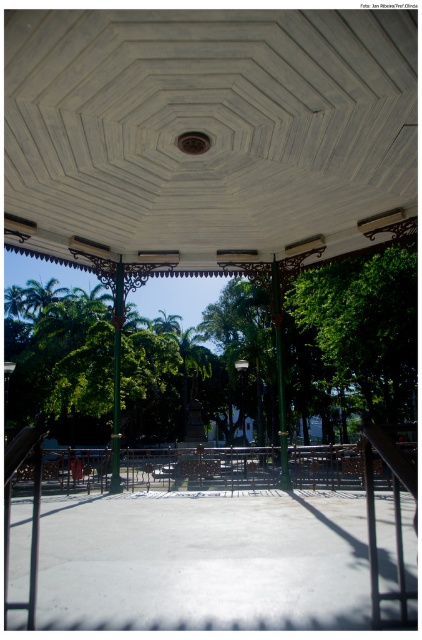
You are standing inside the gazebo and want to place a large bench between the green leafy tree at center and the green leafy tree at right. Which tree should the bench be closer to to ensure it fits within the space?

The bench should be closer to the green leafy tree at right because the green leafy tree at center is wider, so placing the bench closer to the narrower tree allows for more space between them.

You are planning to install a bench between the green leafy tree at center and the green leafy tree at right. The bench is 2 meters long. Will there be enough space to place it between them?

The distance between the green leafy tree at center and the green leafy tree at right is 6.65 meters. Since the bench is only 2 meters long, there is sufficient space to place it between them.

You are standing outside the gazebo and looking towards the structure. Which of the two green leafy trees, the green leafy tree at center or the green leafy tree at right, is positioned more to your left side?

The green leafy tree at center is positioned more to the left side compared to the green leafy tree at right.